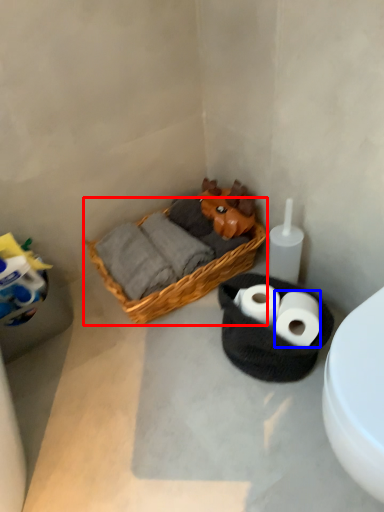
Question: Which object appears farthest to the camera in this image, picnic basket (highlighted by a red box) or toilet paper (highlighted by a blue box)?

Choices:
 (A) picnic basket
 (B) toilet paper

Answer: (A)